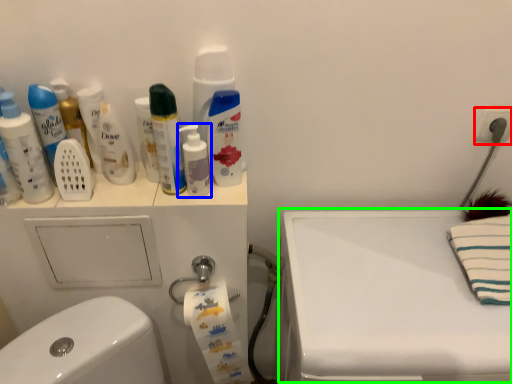
Question: Based on their relative distances, which object is nearer to electric outlet (highlighted by a red box)? Choose from mouthwash (highlighted by a blue box) and counter top (highlighted by a green box).

Choices:
 (A) mouthwash
 (B) counter top

Answer: (B)